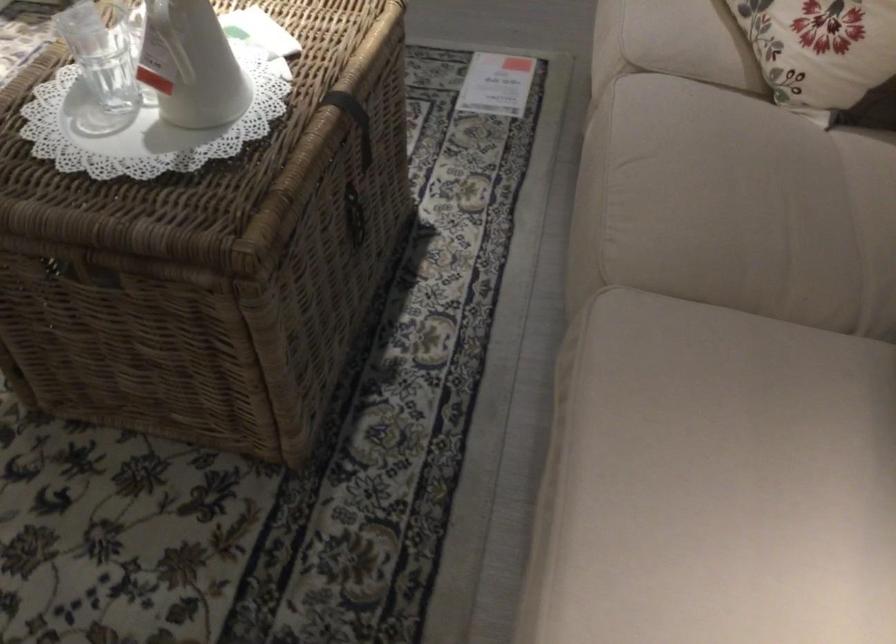
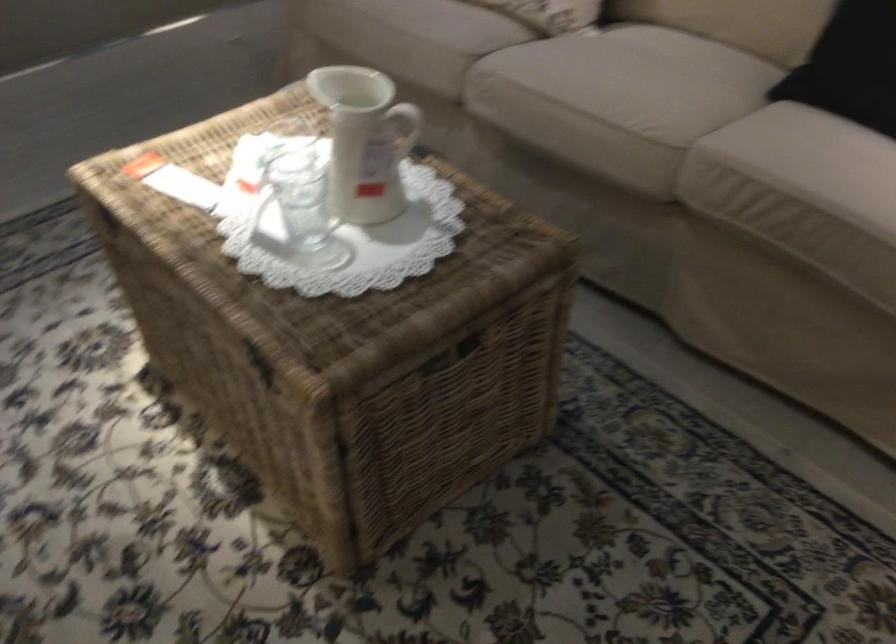
Locate, in the second image, the point that corresponds to pixel 657 181 in the first image.

(617, 93)